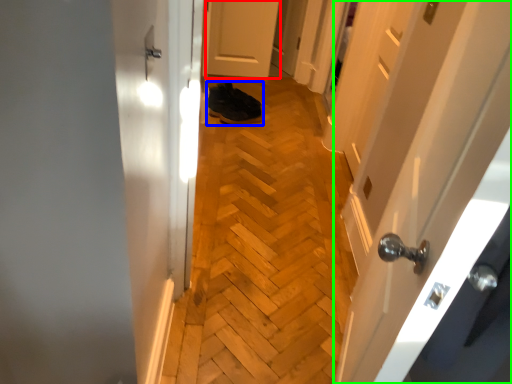
Question: Which object is positioned closest to door (highlighted by a red box)? Select from footwear (highlighted by a blue box) and door (highlighted by a green box).

Choices:
 (A) footwear
 (B) door

Answer: (A)